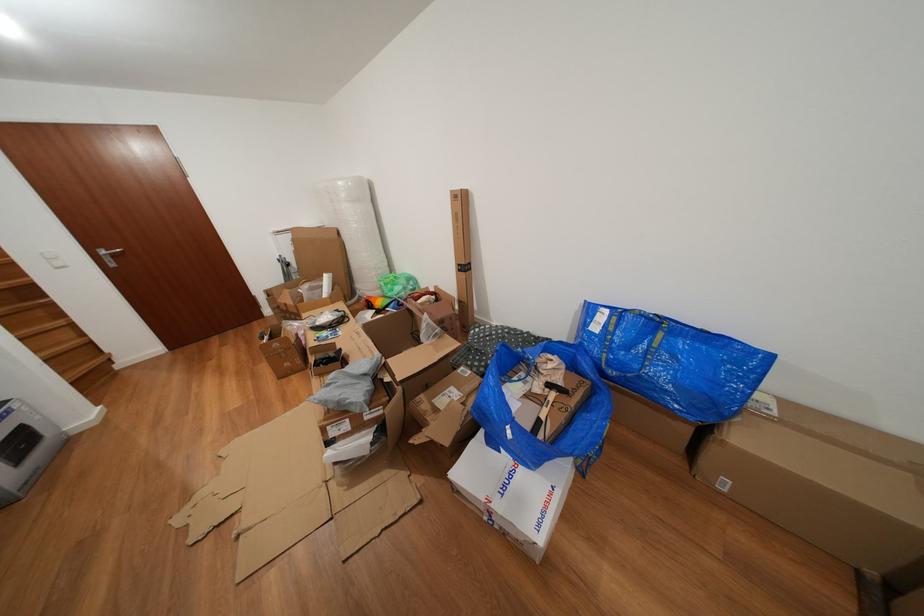
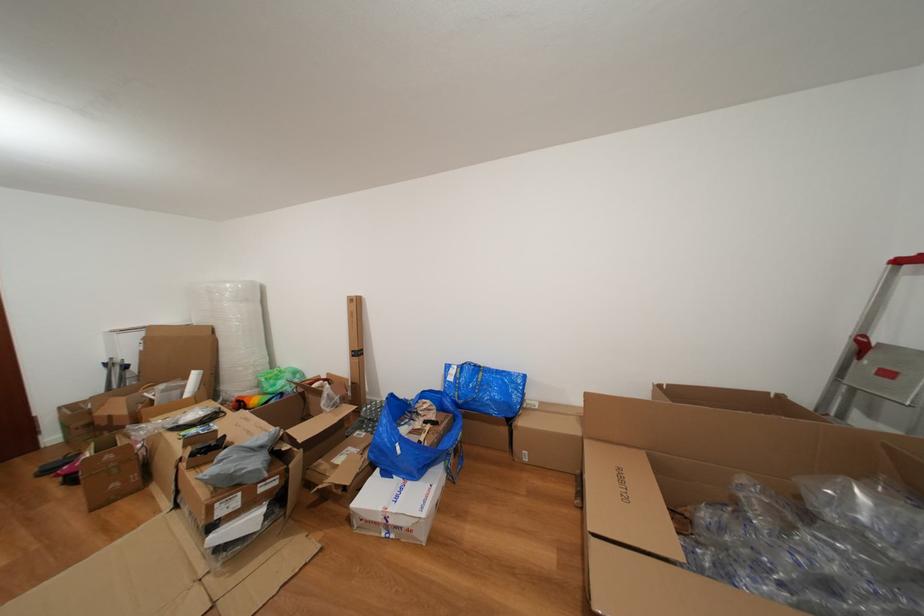
In the second image, find the point that corresponds to (351,200) in the first image.

(237, 301)